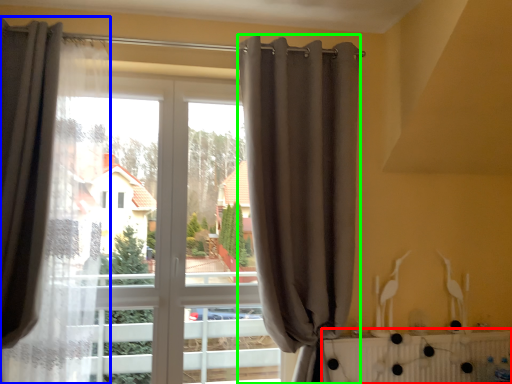
Question: Considering the real-world distances, which object is closest to radiator (highlighted by a red box)? curtain (highlighted by a blue box) or curtain (highlighted by a green box).

Choices:
 (A) curtain
 (B) curtain

Answer: (B)